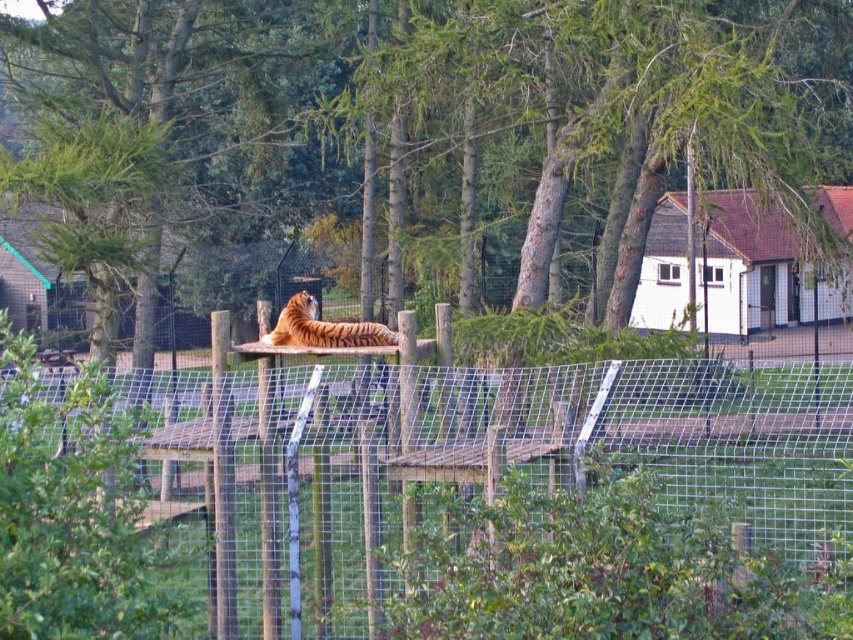
You are a zookeeper planning to install a new sign between the metallic wire mesh at center and the green leafy tree at center. Since the sign must be placed where both are visible, which object should the sign be closer to?

The sign should be placed closer to the metallic wire mesh at center because it is smaller than the green leafy tree at center, allowing both to be visible in the background.

You are a zookeeper who wants to feed the orange striped tiger at center. You have a food tray that you can place on the metallic wire mesh at center. Will the food be within the tiger reach?

The metallic wire mesh at center is located below the orange striped tiger at center, so the food placed on the metallic wire mesh at center will be within the tiger reach.

You are a zoo visitor standing in front of the enclosure. You see the metallic wire mesh at center and the green leafy tree at center. Which object is closer to your left side?

The green leafy tree at center is closer to your left side because the metallic wire mesh at center is positioned on its right side.